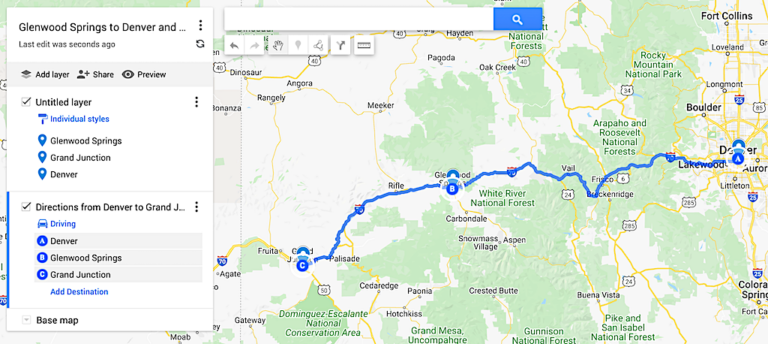
The image size is (768, 344). I want to click on map, so click(x=518, y=300).